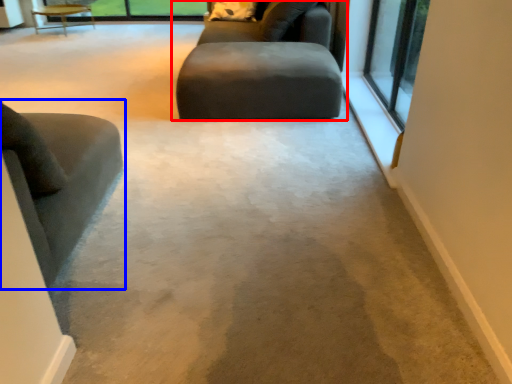
Question: Which of the following is the farthest to the observer, studio couch (highlighted by a red box) or chair (highlighted by a blue box)?

Choices:
 (A) studio couch
 (B) chair

Answer: (A)